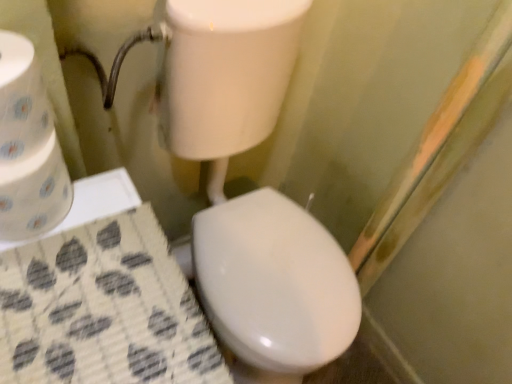
Question: Is white paper towel at left, positioned as the 2th toilet paper in bottom-to-top order, closer to camera compared to white paper towel at left, the second toilet paper in the top-to-bottom sequence?

Choices:
 (A) yes
 (B) no

Answer: (A)

Question: Does white paper towel at left, positioned as the 2th toilet paper in bottom-to-top order, contain white paper towel at left, which ranks as the 1th toilet paper in bottom-to-top order?

Choices:
 (A) no
 (B) yes

Answer: (A)

Question: Is white paper towel at left, positioned as the 1th toilet paper in top-to-bottom order, behind white paper towel at left, the second toilet paper in the top-to-bottom sequence?

Choices:
 (A) yes
 (B) no

Answer: (B)

Question: From a real-world perspective, does white paper towel at left, positioned as the 2th toilet paper in bottom-to-top order, sit lower than white paper towel at left, the second toilet paper in the top-to-bottom sequence?

Choices:
 (A) yes
 (B) no

Answer: (B)

Question: Can you confirm if white paper towel at left, positioned as the 1th toilet paper in top-to-bottom order, is shorter than white paper towel at left, the second toilet paper in the top-to-bottom sequence?

Choices:
 (A) yes
 (B) no

Answer: (A)

Question: From a real-world perspective, is white paper towel at left, positioned as the 1th toilet paper in top-to-bottom order, on white paper towel at left, the second toilet paper in the top-to-bottom sequence?

Choices:
 (A) no
 (B) yes

Answer: (B)

Question: Is white paper towel at left, the second toilet paper in the top-to-bottom sequence, positioned with its back to white paper towel at left, positioned as the 1th toilet paper in top-to-bottom order?

Choices:
 (A) yes
 (B) no

Answer: (B)

Question: From a real-world perspective, does white paper towel at left, which ranks as the 1th toilet paper in bottom-to-top order, stand above white paper towel at left, positioned as the 1th toilet paper in top-to-bottom order?

Choices:
 (A) no
 (B) yes

Answer: (A)

Question: Considering the relative sizes of white paper towel at left, which ranks as the 1th toilet paper in bottom-to-top order, and white paper towel at left, positioned as the 2th toilet paper in bottom-to-top order, in the image provided, is white paper towel at left, which ranks as the 1th toilet paper in bottom-to-top order, taller than white paper towel at left, positioned as the 2th toilet paper in bottom-to-top order,?

Choices:
 (A) no
 (B) yes

Answer: (B)

Question: Is white paper towel at left, the second toilet paper in the top-to-bottom sequence, smaller than white paper towel at left, positioned as the 2th toilet paper in bottom-to-top order?

Choices:
 (A) no
 (B) yes

Answer: (A)

Question: Is white paper towel at left, which ranks as the 1th toilet paper in bottom-to-top order, at the right side of white paper towel at left, positioned as the 1th toilet paper in top-to-bottom order?

Choices:
 (A) no
 (B) yes

Answer: (A)

Question: Does white paper towel at left, which ranks as the 1th toilet paper in bottom-to-top order, have a larger size compared to white paper towel at left, positioned as the 2th toilet paper in bottom-to-top order?

Choices:
 (A) yes
 (B) no

Answer: (A)

Question: Considering the positions of white paper towel at left, which ranks as the 1th toilet paper in bottom-to-top order, and white paper towel at left, positioned as the 2th toilet paper in bottom-to-top order, in the image, is white paper towel at left, which ranks as the 1th toilet paper in bottom-to-top order, taller or shorter than white paper towel at left, positioned as the 2th toilet paper in bottom-to-top order,?

Choices:
 (A) tall
 (B) short

Answer: (A)